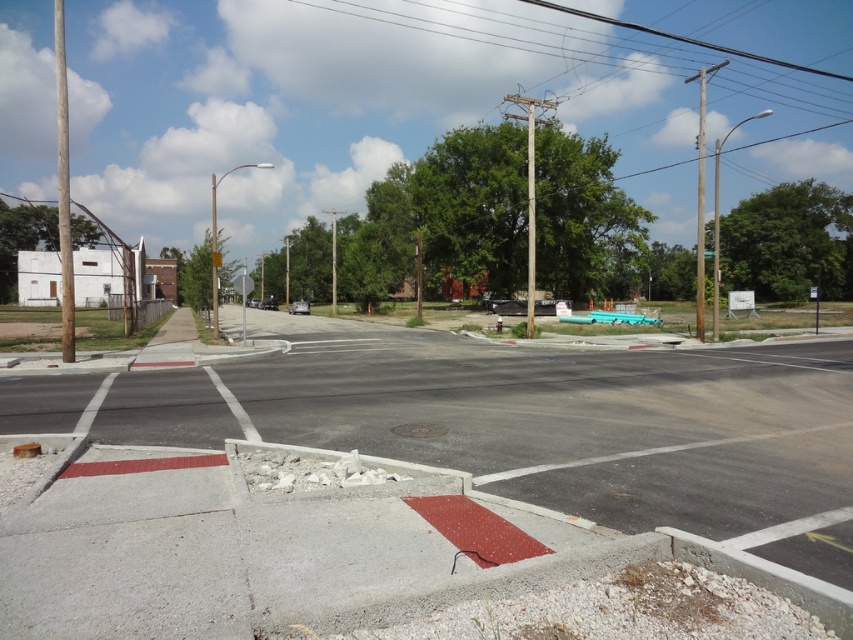
Can you confirm if metallic wire at upper center is positioned above smooth gray pole at center?

Yes.

Which is below, metallic wire at upper center or smooth gray pole at center?

smooth gray pole at center is below.

The image size is (853, 640). I want to click on metallic wire at upper center, so click(608, 48).

I want to click on metallic wire at upper center, so click(x=608, y=48).

Looking at this image, between smooth wooden pole at upper right and metallic pole at left, which one is positioned higher?

smooth wooden pole at upper right is higher up.

Which is behind, point (714, 340) or point (213, 308)?

The point (213, 308) is more distant.

What do you see at coordinates (717, 241) in the screenshot? The height and width of the screenshot is (640, 853). I see `smooth wooden pole at upper right` at bounding box center [717, 241].

I want to click on smooth wooden pole at upper right, so click(717, 241).

Does smooth wood pole at upper right appear on the left side of metallic pole at left?

Incorrect, smooth wood pole at upper right is not on the left side of metallic pole at left.

Is smooth wood pole at upper right wider than metallic pole at left?

Indeed, smooth wood pole at upper right has a greater width compared to metallic pole at left.

This screenshot has width=853, height=640. Identify the location of smooth wood pole at upper right. (700, 204).